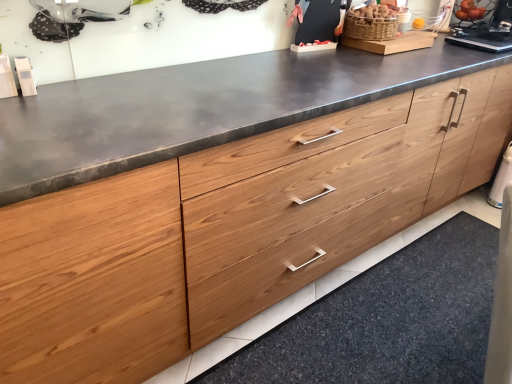
Question: Considering their positions, is woven brown basket at upper right located in front of or behind natural wood drawer at lower center?

Choices:
 (A) front
 (B) behind

Answer: (B)

Question: Considering the positions of woven brown basket at upper right and natural wood drawer at lower center in the image, is woven brown basket at upper right bigger or smaller than natural wood drawer at lower center?

Choices:
 (A) small
 (B) big

Answer: (A)

Question: From the image's perspective, relative to natural wood drawer at lower center, is woven brown basket at upper right above or below?

Choices:
 (A) below
 (B) above

Answer: (B)

Question: From the image's perspective, is natural wood drawer at lower center positioned above or below woven brown basket at upper right?

Choices:
 (A) above
 (B) below

Answer: (B)

Question: Considering their positions, is natural wood drawer at lower center located in front of or behind woven brown basket at upper right?

Choices:
 (A) behind
 (B) front

Answer: (B)

Question: Is natural wood drawer at lower center taller or shorter than woven brown basket at upper right?

Choices:
 (A) tall
 (B) short

Answer: (B)

Question: Is point (479, 266) closer or farther from the camera than point (390, 11)?

Choices:
 (A) closer
 (B) farther

Answer: (B)